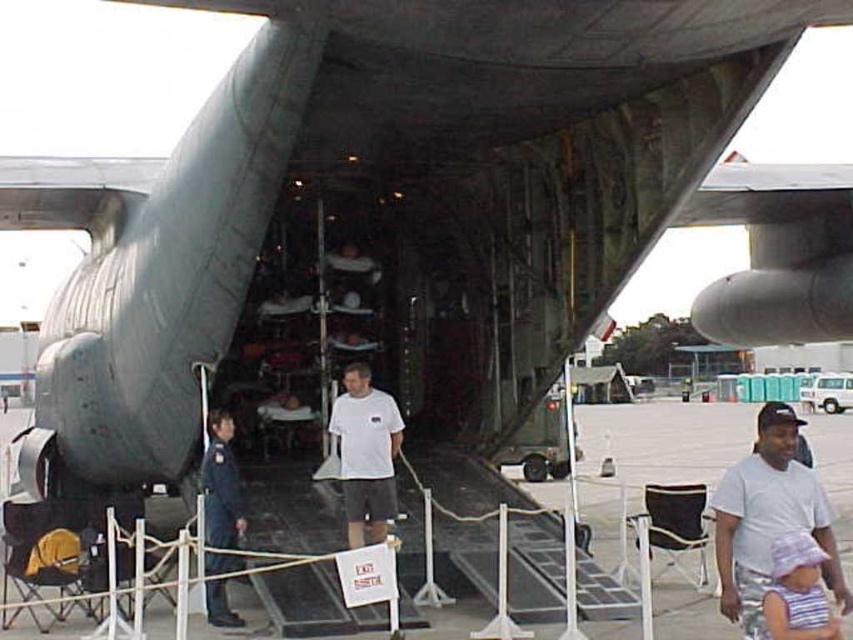
You are a photographer trying to capture a clear shot of the striped fabric hat at lower right without including the gray concrete tarmac at lower center in the frame. Is this possible given their sizes?

The gray concrete tarmac at lower center is bigger than the striped fabric hat at lower right, so it might be challenging to exclude the tarmac entirely due to its larger size. Adjust your camera angle or position to focus solely on the smaller striped fabric hat at lower right.

You are a photographer standing at the back of the scene. You want to take a picture of the white cotton shirt at center and the striped fabric hat at lower right so that both are visible in the frame. Based on their positions, which object should you adjust your camera angle to focus on first to ensure both are in the shot?

The white cotton shirt at center is positioned on the left side of striped fabric hat at lower right, so you should focus on the striped fabric hat at lower right first to ensure both are within the frame.